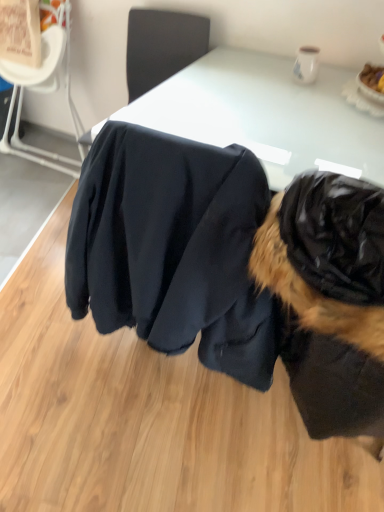
Find the location of a particular element. empty space that is ontop of white glossy table at center (from a real-world perspective) is located at coordinates (x=266, y=105).